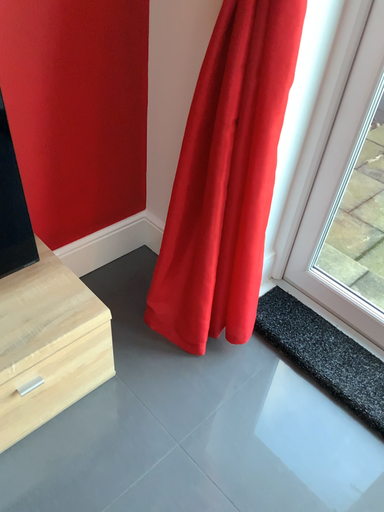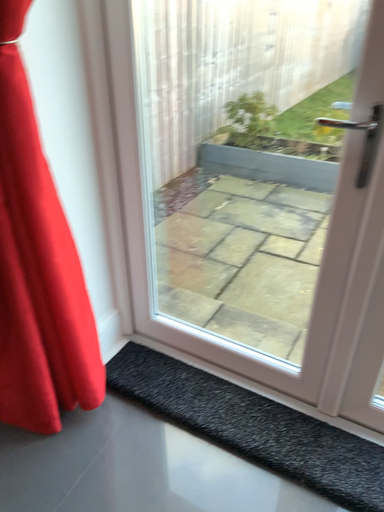
Question: Which way did the camera rotate in the video?

Choices:
 (A) rotated left
 (B) rotated right

Answer: (B)